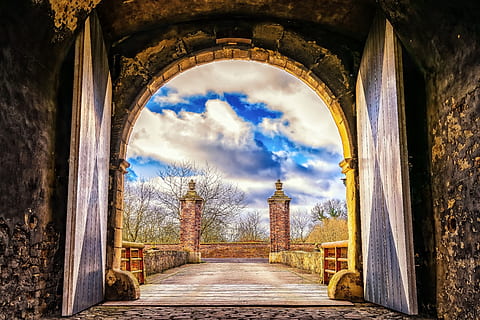
Where is `archway`? The height and width of the screenshot is (320, 480). archway is located at coordinates (140, 107), (230, 53), (323, 96).